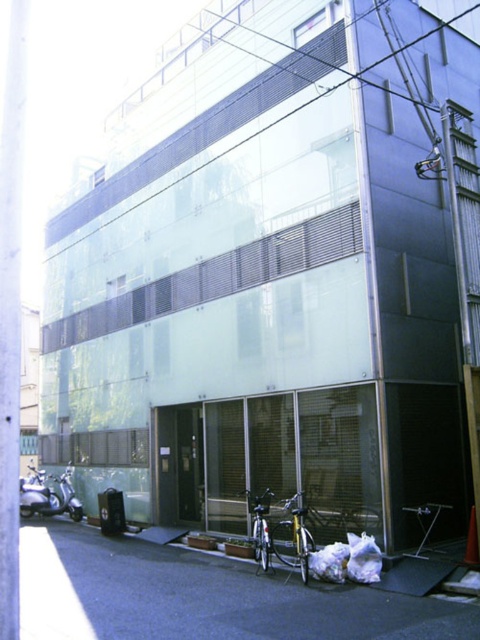
Between yellow metallic bicycle at lower center and silver metallic bicycle at lower center, which one appears on the left side from the viewer's perspective?

silver metallic bicycle at lower center

Find the location of a particular element. yellow metallic bicycle at lower center is located at coordinates [x=292, y=536].

Where is `yellow metallic bicycle at lower center`? Image resolution: width=480 pixels, height=640 pixels. yellow metallic bicycle at lower center is located at coordinates (292, 536).